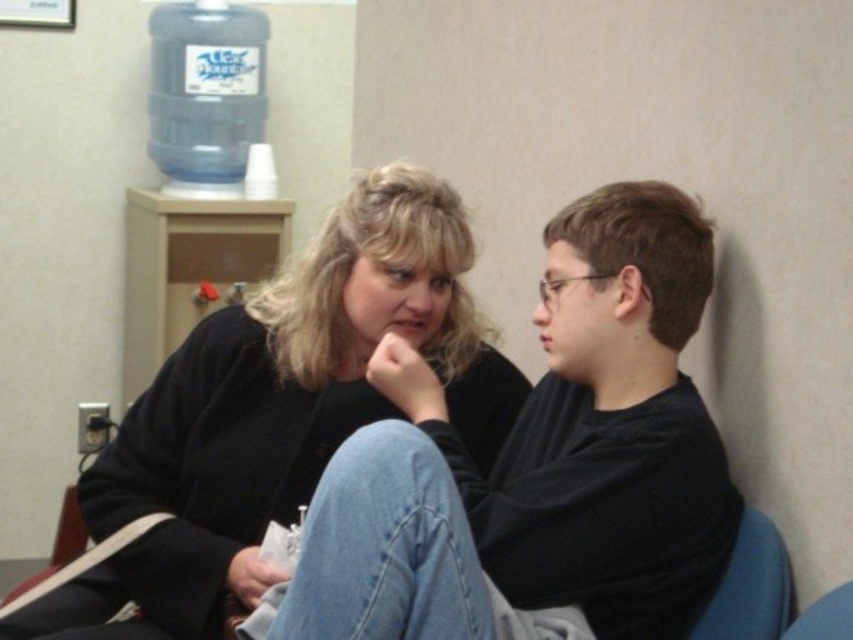
Which is below, black matte shirt at center or blue plastic water cooler at upper left?

black matte shirt at center

Is point (659, 522) more distant than point (164, 54)?

No, (659, 522) is in front of (164, 54).

Is point (396, 628) closer to viewer compared to point (212, 179)?

Yes, it is.

Identify the location of black matte shirt at center. (541, 460).

Does matte black sweater at center have a smaller size compared to blue plastic water cooler at upper left?

No, matte black sweater at center is not smaller than blue plastic water cooler at upper left.

Who is lower down, matte black sweater at center or blue plastic water cooler at upper left?

matte black sweater at center is lower down.

Where is `matte black sweater at center`? matte black sweater at center is located at coordinates (270, 417).

Image resolution: width=853 pixels, height=640 pixels. Identify the location of matte black sweater at center. (270, 417).

Between point (595, 636) and point (242, 337), which one is positioned behind?

The point (242, 337) is more distant.

This screenshot has height=640, width=853. What are the coordinates of `black matte shirt at center` in the screenshot? It's located at (541, 460).